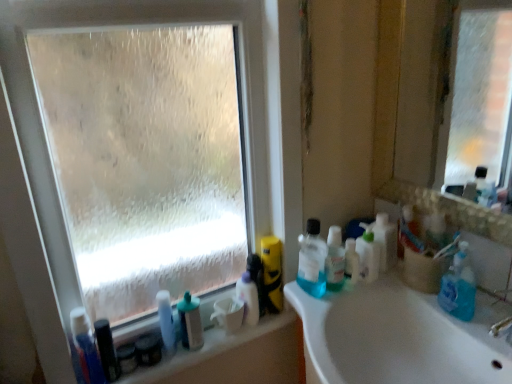
You are a GUI agent. You are given a task and a screenshot of the screen. Output one action in this format:
    pyautogui.click(x=<x>, y=<y>)
    Task: Click on the translucent plastic bottle at lower left, which is counted as the fourth toiletry, starting from the right
    This screenshot has height=384, width=512.
    Given the screenshot: What is the action you would take?
    pyautogui.click(x=166, y=321)

Measure the distance between point (x=381, y=246) and camera.

A distance of 1.19 meters exists between point (x=381, y=246) and camera.

Find the location of a particular element. This screenshot has height=384, width=512. blue translucent liquid at right, the 3th cleaning product positioned from the left is located at coordinates (312, 260).

What is the approximate width of matte black container at lower left, acting as the 2th toiletry starting from the left?

2.39 inches.

This screenshot has width=512, height=384. What do you see at coordinates (127, 358) in the screenshot? I see `matte black container at lower left, acting as the 2th toiletry starting from the left` at bounding box center [127, 358].

In order to face translucent plastic mouthwash at right, acting as the first mouthwash starting from the right, should I rotate leftwards or rightwards?

To face it directly, rotate right by 13.320 degrees.

Where is `translucent plastic bottle at lower left, which is counted as the fourth toiletry, starting from the right`? Image resolution: width=512 pixels, height=384 pixels. translucent plastic bottle at lower left, which is counted as the fourth toiletry, starting from the right is located at coordinates (166, 321).

Find the location of a particular element. The width and height of the screenshot is (512, 384). the 1st mouthwash positioned below the translucent plastic bottles at right, the first toiletry viewed from the right (from the image's perspective) is located at coordinates 351,263.

From a real-world perspective, between translucent plastic bottles at right, the first toiletry viewed from the right, and translucent plastic mouthwash at right, the second mouthwash in the bottom-to-top sequence, who is vertically lower?

translucent plastic mouthwash at right, the second mouthwash in the bottom-to-top sequence.

Does translucent plastic bottles at right, the first toiletry viewed from the right, lie in front of translucent plastic mouthwash at right, the second mouthwash in the bottom-to-top sequence?

No, it is not.

Is translucent plastic bottles at right, the first toiletry viewed from the right, taller than translucent plastic mouthwash at right, placed as the first mouthwash when sorted from top to bottom?

Correct, translucent plastic bottles at right, the first toiletry viewed from the right, is much taller as translucent plastic mouthwash at right, placed as the first mouthwash when sorted from top to bottom.

Visually, is blue translucent bottle at right, marked as the fifth cleaning product in a left-to-right arrangement, positioned to the left or to the right of translucent plastic bottles at right, acting as the second cleaning product starting from the right?

Clearly, blue translucent bottle at right, marked as the fifth cleaning product in a left-to-right arrangement, is on the right of translucent plastic bottles at right, acting as the second cleaning product starting from the right, in the image.

In terms of height, does blue translucent bottle at right, which is counted as the 1th cleaning product, starting from the right, look taller or shorter compared to translucent plastic bottles at right, acting as the second cleaning product starting from the right?

Clearly, blue translucent bottle at right, which is counted as the 1th cleaning product, starting from the right, is taller compared to translucent plastic bottles at right, acting as the second cleaning product starting from the right.

Where is `the 2nd cleaning product in front when counting from the translucent plastic bottles at right, acting as the second cleaning product starting from the right`? The image size is (512, 384). the 2nd cleaning product in front when counting from the translucent plastic bottles at right, acting as the second cleaning product starting from the right is located at coordinates (459, 286).

Does blue translucent bottle at right, which is counted as the 1th cleaning product, starting from the right, turn towards translucent plastic bottles at right, acting as the second cleaning product starting from the right?

No.

Looking at this image, is black plastic toothbrush at lower left, which is counted as the first toiletry, starting from the left, positioned far away from translucent plastic mouthwash at lower center, which ranks as the 2th mouthwash in top-to-bottom order?

That's not correct — black plastic toothbrush at lower left, which is counted as the first toiletry, starting from the left, is a little close to translucent plastic mouthwash at lower center, which ranks as the 2th mouthwash in top-to-bottom order.

From a real-world perspective, is black plastic toothbrush at lower left, arranged as the seventh toiletry when viewed from the right, beneath translucent plastic mouthwash at lower center, which is counted as the second mouthwash, starting from the right?

Correct, in the physical world, black plastic toothbrush at lower left, arranged as the seventh toiletry when viewed from the right, is lower than translucent plastic mouthwash at lower center, which is counted as the second mouthwash, starting from the right.

Is point (110, 358) more distant than point (199, 345)?

No, (110, 358) is closer to viewer.

Can you tell me how much black plastic toothbrush at lower left, arranged as the seventh toiletry when viewed from the right, and translucent plastic mouthwash at lower center, which ranks as the 1th mouthwash in left-to-right order, differ in facing direction?

The facing directions of black plastic toothbrush at lower left, arranged as the seventh toiletry when viewed from the right, and translucent plastic mouthwash at lower center, which ranks as the 1th mouthwash in left-to-right order, are 0.000476 degrees apart.

Between white glossy spray bottle at lower center, arranged as the third toiletry when viewed from the right, and white glossy sink at center, which one appears on the left side from the viewer's perspective?

Positioned to the left is white glossy spray bottle at lower center, arranged as the third toiletry when viewed from the right.

Is point (236, 287) closer to viewer compared to point (498, 355)?

No.

Locate an element on the screen. The width and height of the screenshot is (512, 384). sink in front of the white glossy spray bottle at lower center, acting as the fifth toiletry starting from the left is located at coordinates (398, 337).

Consider the image. Is white glossy sink at center surrounded by white glossy spray bottle at lower center, arranged as the third toiletry when viewed from the right?

No, white glossy sink at center is not a part of white glossy spray bottle at lower center, arranged as the third toiletry when viewed from the right.

From their relative heights in the image, would you say white glossy spray bottle at lower center, acting as the fifth toiletry starting from the left, is taller or shorter than white plastic bottles at lower left?

white glossy spray bottle at lower center, acting as the fifth toiletry starting from the left, is taller than white plastic bottles at lower left.

Is white glossy spray bottle at lower center, arranged as the third toiletry when viewed from the right, inside or outside of white plastic bottles at lower left?

white glossy spray bottle at lower center, arranged as the third toiletry when viewed from the right, is not enclosed by white plastic bottles at lower left.

Does white glossy spray bottle at lower center, acting as the fifth toiletry starting from the left, appear on the right side of white plastic bottles at lower left?

Correct, you'll find white glossy spray bottle at lower center, acting as the fifth toiletry starting from the left, to the right of white plastic bottles at lower left.

From the image's perspective, is white glossy spray bottle at lower center, arranged as the third toiletry when viewed from the right, beneath white plastic bottles at lower left?

Actually, white glossy spray bottle at lower center, arranged as the third toiletry when viewed from the right, appears above white plastic bottles at lower left in the image.

Would you say clear plastic mouthwash at center, which ranks as the 2th toiletry in right-to-left order, contains blue translucent liquid at right, arranged as the 3th cleaning product when viewed from the right?

No, blue translucent liquid at right, arranged as the 3th cleaning product when viewed from the right, is not surrounded by clear plastic mouthwash at center, which ranks as the 2th toiletry in right-to-left order.

Which of these two, clear plastic mouthwash at center, which ranks as the 2th toiletry in right-to-left order, or blue translucent liquid at right, the 3th cleaning product positioned from the left, stands shorter?

With less height is clear plastic mouthwash at center, which ranks as the 2th toiletry in right-to-left order.

Which of these two, clear plastic mouthwash at center, which ranks as the 2th toiletry in right-to-left order, or blue translucent liquid at right, the 3th cleaning product positioned from the left, is wider?

Wider between the two is blue translucent liquid at right, the 3th cleaning product positioned from the left.

Is translucent plastic bottles at right, acting as the second cleaning product starting from the right, facing towards matte black container at lower left, positioned as the sixth toiletry in right-to-left order?

No, translucent plastic bottles at right, acting as the second cleaning product starting from the right, is not facing towards matte black container at lower left, positioned as the sixth toiletry in right-to-left order.

Considering the relative sizes of translucent plastic bottles at right, the fourth cleaning product in the left-to-right sequence, and matte black container at lower left, positioned as the sixth toiletry in right-to-left order, in the image provided, is translucent plastic bottles at right, the fourth cleaning product in the left-to-right sequence, wider than matte black container at lower left, positioned as the sixth toiletry in right-to-left order,?

Correct, the width of translucent plastic bottles at right, the fourth cleaning product in the left-to-right sequence, exceeds that of matte black container at lower left, positioned as the sixth toiletry in right-to-left order.

From the picture: From the image's perspective, which one is positioned lower, translucent plastic bottles at right, acting as the second cleaning product starting from the right, or matte black container at lower left, acting as the 2th toiletry starting from the left?

matte black container at lower left, acting as the 2th toiletry starting from the left.

From a real-world perspective, is translucent plastic bottles at right, the fourth cleaning product in the left-to-right sequence, beneath matte black container at lower left, acting as the 2th toiletry starting from the left?

No, from a real-world perspective, translucent plastic bottles at right, the fourth cleaning product in the left-to-right sequence, is not below matte black container at lower left, acting as the 2th toiletry starting from the left.

From a real-world perspective, count 1st mouthwashs downward from the translucent plastic bottles at right, the first toiletry viewed from the right, and point to it. Please provide its 2D coordinates.

[(351, 263)]

From the translucent plastic bottles at right, the fourth cleaning product in the left-to-right sequence, count 2nd cleaning products forward and point to it. Please provide its 2D coordinates.

[(459, 286)]

From the image, which object appears to be farther from matte black container at lower left, acting as the 2th toiletry starting from the left, blue plastic toothbrush at lower left, which is the 1th cleaning product from left to right, or white plastic bottles at lower left?

white plastic bottles at lower left is further to matte black container at lower left, acting as the 2th toiletry starting from the left.

Estimate the real-world distances between objects in this image. Which object is further from white plastic bottles at lower left, matte black container at lower left, acting as the 2th toiletry starting from the left, or translucent plastic bottle at lower left, which is counted as the fourth toiletry, starting from the right?

The object further to white plastic bottles at lower left is matte black container at lower left, acting as the 2th toiletry starting from the left.

Looking at the image, which one is located further to matte black container at lower left, which ranks as the fifth toiletry in right-to-left order, yellow matte sponge at center, the fourth cleaning product in the right-to-left sequence, or white glossy sink at center?

white glossy sink at center lies further to matte black container at lower left, which ranks as the fifth toiletry in right-to-left order, than the other object.

When comparing their distances from blue translucent liquid at right, the 3th cleaning product positioned from the left, does translucent plastic bottles at right, the first toiletry viewed from the right, or matte black container at lower left, which ranks as the fifth toiletry in right-to-left order, seem further?

matte black container at lower left, which ranks as the fifth toiletry in right-to-left order.

From the image, which object appears to be farther from yellow matte sponge at center, the second cleaning product when ordered from left to right, white plastic bottles at lower left or translucent plastic bottles at right, acting as the second cleaning product starting from the right?

The object further to yellow matte sponge at center, the second cleaning product when ordered from left to right, is translucent plastic bottles at right, acting as the second cleaning product starting from the right.

Looking at the image, which one is located closer to white plastic bottles at lower left, blue translucent liquid at right, arranged as the 3th cleaning product when viewed from the right, or blue plastic toothbrush at lower left, which is the 5th cleaning product in right-to-left order?

blue translucent liquid at right, arranged as the 3th cleaning product when viewed from the right, lies closer to white plastic bottles at lower left than the other object.

Considering their positions, is translucent plastic bottles at right, the 7th toiletry viewed from the left, positioned closer to white glossy spray bottle at lower center, arranged as the third toiletry when viewed from the right, than transparent frosted glass at upper left?

translucent plastic bottles at right, the 7th toiletry viewed from the left, is closer to white glossy spray bottle at lower center, arranged as the third toiletry when viewed from the right.

Consider the image. From the image, which object appears to be farther from blue translucent liquid at right, the 3th cleaning product positioned from the left, black plastic toothbrush at lower left, which is counted as the first toiletry, starting from the left, or translucent plastic bottles at right, the fourth cleaning product in the left-to-right sequence?

black plastic toothbrush at lower left, which is counted as the first toiletry, starting from the left, is further to blue translucent liquid at right, the 3th cleaning product positioned from the left.

Where is `counter top between blue plastic toothbrush at lower left, which is the 5th cleaning product in right-to-left order, and blue translucent bottle at right, which is counted as the 1th cleaning product, starting from the right`? Image resolution: width=512 pixels, height=384 pixels. counter top between blue plastic toothbrush at lower left, which is the 5th cleaning product in right-to-left order, and blue translucent bottle at right, which is counted as the 1th cleaning product, starting from the right is located at coordinates (232, 357).

I want to click on mouthwash between matte black container at lower left, which ranks as the fifth toiletry in right-to-left order, and blue translucent liquid at right, the 3th cleaning product positioned from the left, so click(x=190, y=322).

You are a GUI agent. You are given a task and a screenshot of the screen. Output one action in this format:
    pyautogui.click(x=<x>, y=<y>)
    Task: Click on the cleaning product between translucent plastic mouthwash at right, acting as the first mouthwash starting from the right, and translucent plastic bottles at right, the 7th toiletry viewed from the left
    This screenshot has width=512, height=384.
    Given the screenshot: What is the action you would take?
    pos(368,254)

I want to click on counter top located between translucent plastic bottle at lower left, positioned as the fourth toiletry in left-to-right order, and blue translucent liquid at right, arranged as the 3th cleaning product when viewed from the right, in the left-right direction, so click(x=232, y=357).